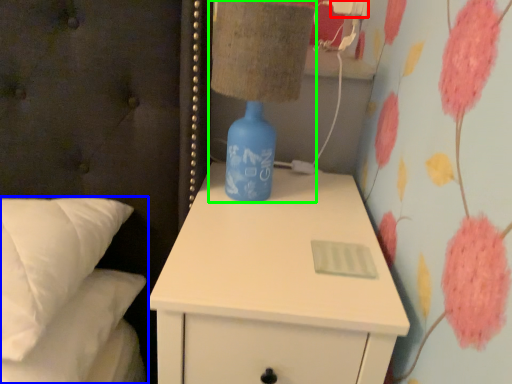
Question: Based on their relative distances, which object is nearer to electric outlet (highlighted by a red box)? Choose from bed (highlighted by a blue box) and table lamp (highlighted by a green box).

Choices:
 (A) bed
 (B) table lamp

Answer: (B)